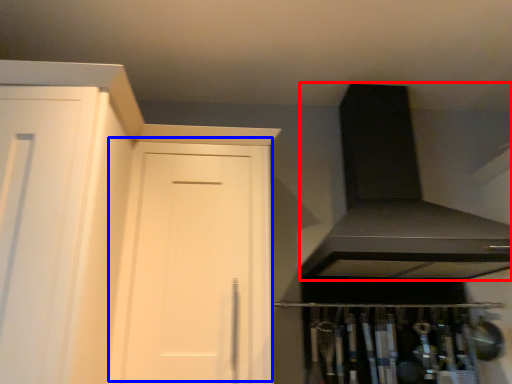
Question: Which object appears farthest to the camera in this image, exhaust hood (highlighted by a red box) or door (highlighted by a blue box)?

Choices:
 (A) exhaust hood
 (B) door

Answer: (B)